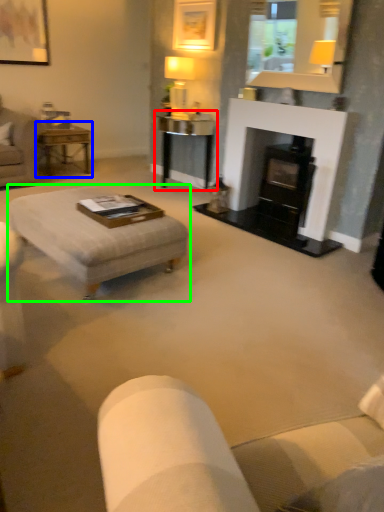
Question: Based on their relative distances, which object is farther from table (highlighted by a red box)? Choose from table (highlighted by a blue box) and coffee table (highlighted by a green box).

Choices:
 (A) table
 (B) coffee table

Answer: (B)